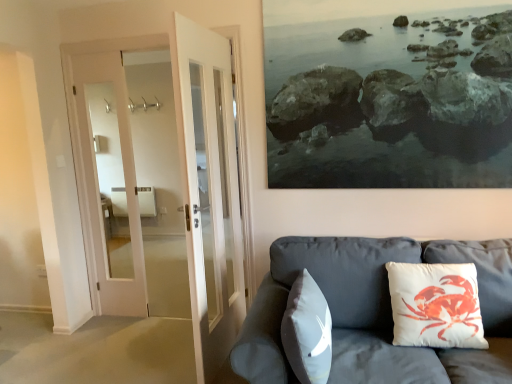
Question: Considering the relative sizes of white matte pillow at center, acting as the second pillow starting from the right, and matte gray couch at lower right in the image provided, is white matte pillow at center, acting as the second pillow starting from the right, bigger than matte gray couch at lower right?

Choices:
 (A) yes
 (B) no

Answer: (B)

Question: Does white matte pillow at center, the 1th pillow when ordered from left to right, contain matte gray couch at lower right?

Choices:
 (A) yes
 (B) no

Answer: (B)

Question: Can you confirm if white matte pillow at center, acting as the second pillow starting from the right, is positioned to the right of matte gray couch at lower right?

Choices:
 (A) yes
 (B) no

Answer: (B)

Question: Can you confirm if white matte pillow at center, the 1th pillow when ordered from left to right, is taller than matte gray couch at lower right?

Choices:
 (A) no
 (B) yes

Answer: (A)

Question: Does white matte pillow at center, the 1th pillow when ordered from left to right, have a lesser width compared to matte gray couch at lower right?

Choices:
 (A) yes
 (B) no

Answer: (A)

Question: From the image's perspective, is white matte pillow at center, acting as the second pillow starting from the right, under matte gray couch at lower right?

Choices:
 (A) yes
 (B) no

Answer: (B)

Question: From a real-world perspective, is white matte pillow at center, the 1th pillow when ordered from left to right, over white cotton cushion with crab print at right, the 1th pillow viewed from the right?

Choices:
 (A) no
 (B) yes

Answer: (A)

Question: Could white cotton cushion with crab print at right, which is counted as the 2th pillow, starting from the left, be considered to be inside white matte pillow at center, the 1th pillow when ordered from left to right?

Choices:
 (A) no
 (B) yes

Answer: (A)

Question: Is the depth of white matte pillow at center, the 1th pillow when ordered from left to right, greater than that of white cotton cushion with crab print at right, the 1th pillow viewed from the right?

Choices:
 (A) yes
 (B) no

Answer: (B)

Question: Considering the relative positions of white matte pillow at center, acting as the second pillow starting from the right, and white cotton cushion with crab print at right, the 1th pillow viewed from the right, in the image provided, is white matte pillow at center, acting as the second pillow starting from the right, in front of white cotton cushion with crab print at right, the 1th pillow viewed from the right,?

Choices:
 (A) yes
 (B) no

Answer: (A)

Question: Is white matte pillow at center, the 1th pillow when ordered from left to right, in contact with white cotton cushion with crab print at right, the 1th pillow viewed from the right?

Choices:
 (A) yes
 (B) no

Answer: (B)

Question: Is white matte pillow at center, the 1th pillow when ordered from left to right, not near white cotton cushion with crab print at right, which is counted as the 2th pillow, starting from the left?

Choices:
 (A) no
 (B) yes

Answer: (A)

Question: Are matte gray couch at lower right and white cotton cushion with crab print at right, the 1th pillow viewed from the right, located far from each other?

Choices:
 (A) no
 (B) yes

Answer: (A)